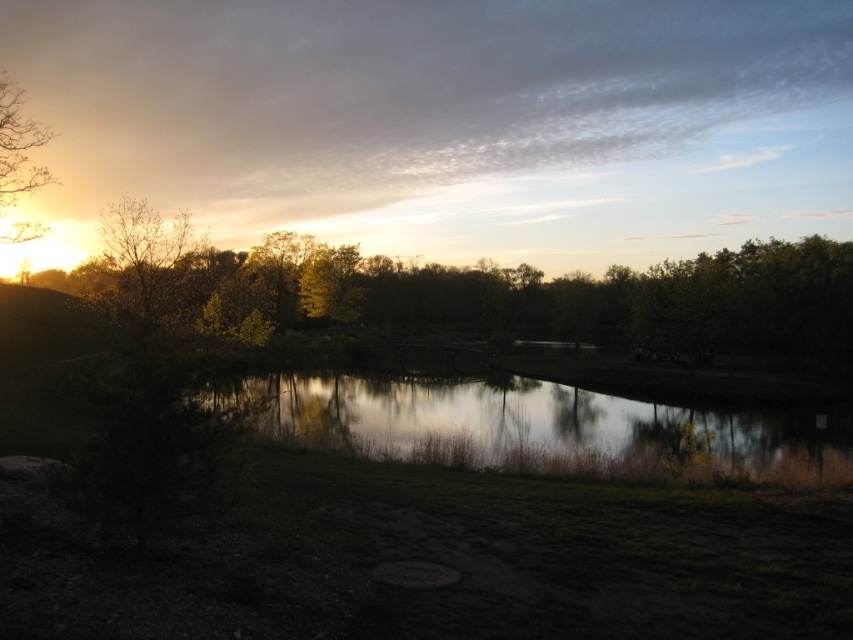
You are standing in the serene outdoor scene and want to walk from the green leafy tree at left to the reflective glass water at center. Which direction should you move to reach the water?

You should move to the left to reach the reflective glass water at center because the green leafy tree at left is positioned on the right side of reflective glass water at center.

You are standing at the center of the image and want to walk towards the green leafy tree at left. In which direction should you move?

You should move towards the left direction to reach the green leafy tree at left since its 2D location is at point (543, 296), which is on the left side of the image.

You are standing in the serene outdoor scene and want to take a photo of both the green leafy tree at left and the brown leafy tree at upper left. Which tree should you focus on first to ensure both are in clear view?

You should focus on the green leafy tree at left first because it is closer to you than the brown leafy tree at upper left, so adjusting focus from near to far will help capture both clearly.